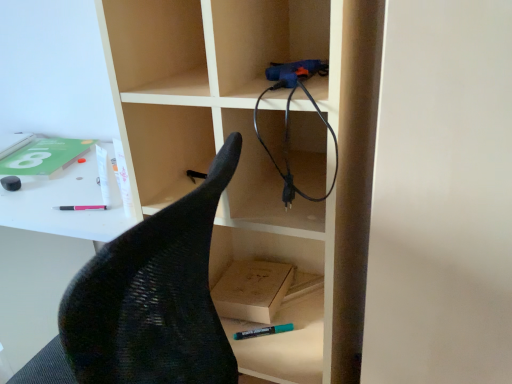
Question: From the image's perspective, is black mesh chair at left on black rubber cable at upper right?

Choices:
 (A) yes
 (B) no

Answer: (B)

Question: Are black mesh chair at left and black rubber cable at upper right making contact?

Choices:
 (A) yes
 (B) no

Answer: (B)

Question: Is black mesh chair at left not near black rubber cable at upper right?

Choices:
 (A) yes
 (B) no

Answer: (B)

Question: Considering the relative sizes of black mesh chair at left and black rubber cable at upper right in the image provided, is black mesh chair at left smaller than black rubber cable at upper right?

Choices:
 (A) no
 (B) yes

Answer: (A)

Question: Considering the relative positions of black mesh chair at left and black rubber cable at upper right in the image provided, is black mesh chair at left to the left of black rubber cable at upper right from the viewer's perspective?

Choices:
 (A) no
 (B) yes

Answer: (B)

Question: Does black mesh chair at left have a greater width compared to black rubber cable at upper right?

Choices:
 (A) no
 (B) yes

Answer: (B)

Question: Can you confirm if black rubber cable at upper right is positioned to the left of teal matte marker at lower center, marked as the 1th stationery in a front-to-back arrangement?

Choices:
 (A) no
 (B) yes

Answer: (A)

Question: From the image's perspective, is black rubber cable at upper right below teal matte marker at lower center, marked as the 1th stationery in a front-to-back arrangement?

Choices:
 (A) yes
 (B) no

Answer: (B)

Question: Considering the relative positions of black rubber cable at upper right and teal matte marker at lower center, marked as the second stationery in a back-to-front arrangement, in the image provided, is black rubber cable at upper right in front of teal matte marker at lower center, marked as the second stationery in a back-to-front arrangement,?

Choices:
 (A) no
 (B) yes

Answer: (B)

Question: Is black rubber cable at upper right directly adjacent to teal matte marker at lower center, marked as the 1th stationery in a front-to-back arrangement?

Choices:
 (A) yes
 (B) no

Answer: (B)

Question: Is teal matte marker at lower center, marked as the 1th stationery in a front-to-back arrangement, located within black rubber cable at upper right?

Choices:
 (A) yes
 (B) no

Answer: (B)

Question: Considering the relative sizes of black rubber cable at upper right and teal matte marker at lower center, the 2th stationery in the top-to-bottom sequence, in the image provided, is black rubber cable at upper right smaller than teal matte marker at lower center, the 2th stationery in the top-to-bottom sequence,?

Choices:
 (A) no
 (B) yes

Answer: (A)

Question: Is light brown cardboard box at lower center oriented away from black mesh chair at left?

Choices:
 (A) no
 (B) yes

Answer: (A)